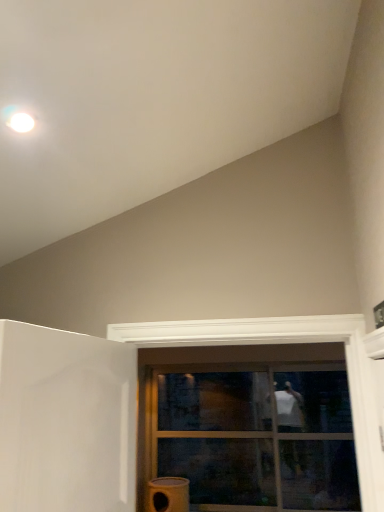
Question: Can you confirm if clear glass window at center is positioned to the right of transparent glass door at center?

Choices:
 (A) no
 (B) yes

Answer: (B)

Question: Can you confirm if clear glass window at center is bigger than transparent glass door at center?

Choices:
 (A) yes
 (B) no

Answer: (A)

Question: Does clear glass window at center have a lesser height compared to transparent glass door at center?

Choices:
 (A) no
 (B) yes

Answer: (A)

Question: Does clear glass window at center have a lesser width compared to transparent glass door at center?

Choices:
 (A) yes
 (B) no

Answer: (B)

Question: Is clear glass window at center further to camera compared to transparent glass door at center?

Choices:
 (A) no
 (B) yes

Answer: (A)

Question: Relative to clear glass window at center, is matte yellow water heater at lower center in front or behind?

Choices:
 (A) behind
 (B) front

Answer: (B)

Question: Based on their sizes in the image, would you say matte yellow water heater at lower center is bigger or smaller than clear glass window at center?

Choices:
 (A) big
 (B) small

Answer: (B)

Question: Do you think matte yellow water heater at lower center is within clear glass window at center, or outside of it?

Choices:
 (A) inside
 (B) outside

Answer: (B)

Question: Considering the positions of matte yellow water heater at lower center and clear glass window at center in the image, is matte yellow water heater at lower center wider or thinner than clear glass window at center?

Choices:
 (A) wide
 (B) thin

Answer: (B)

Question: Is clear glass window at center bigger or smaller than transparent glass door at center?

Choices:
 (A) small
 (B) big

Answer: (B)

Question: Is clear glass window at center in front of or behind transparent glass door at center in the image?

Choices:
 (A) front
 (B) behind

Answer: (A)

Question: From a real-world perspective, is clear glass window at center physically located above or below transparent glass door at center?

Choices:
 (A) above
 (B) below

Answer: (A)

Question: Is clear glass window at center wider or thinner than transparent glass door at center?

Choices:
 (A) wide
 (B) thin

Answer: (A)

Question: From a real-world perspective, is transparent glass door at center positioned above or below clear glass window at center?

Choices:
 (A) above
 (B) below

Answer: (B)

Question: From their relative heights in the image, would you say transparent glass door at center is taller or shorter than clear glass window at center?

Choices:
 (A) tall
 (B) short

Answer: (B)